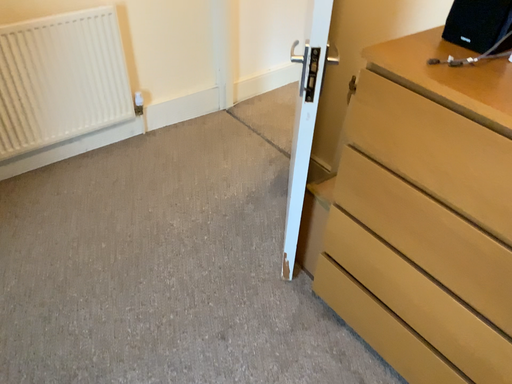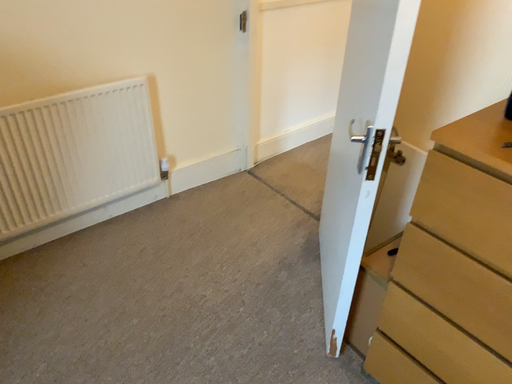
Question: Which way did the camera rotate in the video?

Choices:
 (A) rotated upward
 (B) rotated downward

Answer: (A)